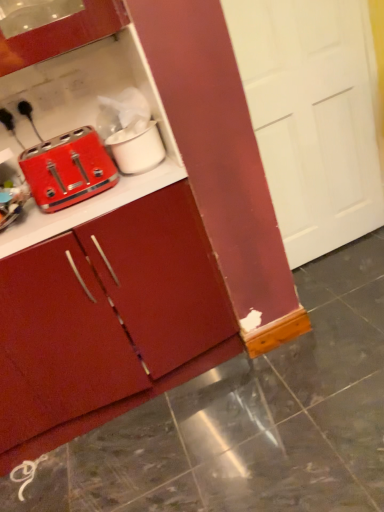
Question: Is white matte pot at upper center to the right of white glossy tile at lower left from the viewer's perspective?

Choices:
 (A) no
 (B) yes

Answer: (B)

Question: Is white matte pot at upper center completely or partially outside of white glossy tile at lower left?

Choices:
 (A) yes
 (B) no

Answer: (A)

Question: Is white matte pot at upper center positioned far away from white glossy tile at lower left?

Choices:
 (A) yes
 (B) no

Answer: (A)

Question: From a real-world perspective, is white matte pot at upper center positioned under white glossy tile at lower left based on gravity?

Choices:
 (A) yes
 (B) no

Answer: (B)

Question: Can you confirm if white matte pot at upper center is positioned to the left of white glossy tile at lower left?

Choices:
 (A) no
 (B) yes

Answer: (A)

Question: From the image's perspective, would you say white matte pot at upper center is positioned over white glossy tile at lower left?

Choices:
 (A) no
 (B) yes

Answer: (B)

Question: Is white glossy tile at lower left located outside white matte pot at upper center?

Choices:
 (A) yes
 (B) no

Answer: (A)

Question: Considering the relative positions of white glossy tile at lower left and white matte pot at upper center in the image provided, is white glossy tile at lower left to the left of white matte pot at upper center from the viewer's perspective?

Choices:
 (A) no
 (B) yes

Answer: (B)

Question: Considering the relative positions of white glossy tile at lower left and white matte pot at upper center in the image provided, is white glossy tile at lower left behind white matte pot at upper center?

Choices:
 (A) no
 (B) yes

Answer: (B)

Question: From a real-world perspective, is white glossy tile at lower left positioned over white matte pot at upper center based on gravity?

Choices:
 (A) no
 (B) yes

Answer: (A)

Question: Is white glossy tile at lower left surrounding white matte pot at upper center?

Choices:
 (A) yes
 (B) no

Answer: (B)

Question: Does white glossy tile at lower left touch white matte pot at upper center?

Choices:
 (A) no
 (B) yes

Answer: (A)

Question: Are matte red toaster at left and matte red cabinet at center far apart?

Choices:
 (A) yes
 (B) no

Answer: (B)